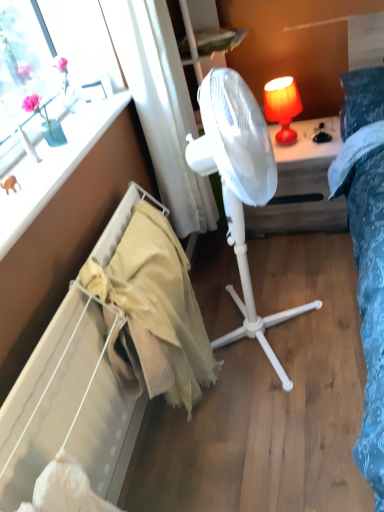
Question: Considering the relative sizes of white sheer curtain at upper center and white plastic fan at center in the image provided, is white sheer curtain at upper center taller than white plastic fan at center?

Choices:
 (A) no
 (B) yes

Answer: (B)

Question: Considering the relative sizes of white sheer curtain at upper center and white plastic fan at center in the image provided, is white sheer curtain at upper center bigger than white plastic fan at center?

Choices:
 (A) no
 (B) yes

Answer: (A)

Question: Is white sheer curtain at upper center at the left side of white plastic fan at center?

Choices:
 (A) no
 (B) yes

Answer: (B)

Question: Is white sheer curtain at upper center positioned with its back to white plastic fan at center?

Choices:
 (A) no
 (B) yes

Answer: (A)

Question: From a real-world perspective, does white sheer curtain at upper center sit lower than white plastic fan at center?

Choices:
 (A) yes
 (B) no

Answer: (B)

Question: Looking at their shapes, would you say white plastic fan at center is wider or thinner than white plastic fan at center?

Choices:
 (A) wide
 (B) thin

Answer: (B)

Question: Considering the positions of white plastic fan at center and white plastic fan at center in the image, is white plastic fan at center taller or shorter than white plastic fan at center?

Choices:
 (A) tall
 (B) short

Answer: (A)

Question: Is white plastic fan at center in front of or behind white plastic fan at center in the image?

Choices:
 (A) behind
 (B) front

Answer: (B)

Question: From the image's perspective, is white plastic fan at center positioned above or below white plastic fan at center?

Choices:
 (A) above
 (B) below

Answer: (B)

Question: From a real-world perspective, is white sheer curtain at upper center above or below beige fabric radiator at lower left?

Choices:
 (A) below
 (B) above

Answer: (B)

Question: From the image's perspective, is white sheer curtain at upper center located above or below beige fabric radiator at lower left?

Choices:
 (A) below
 (B) above

Answer: (B)

Question: In the image, is white sheer curtain at upper center positioned in front of or behind beige fabric radiator at lower left?

Choices:
 (A) front
 (B) behind

Answer: (B)

Question: Based on their sizes in the image, would you say white sheer curtain at upper center is bigger or smaller than beige fabric radiator at lower left?

Choices:
 (A) small
 (B) big

Answer: (B)

Question: Is white plastic fan at center in front of or behind white plastic fan at center in the image?

Choices:
 (A) behind
 (B) front

Answer: (A)

Question: Is white plastic fan at center bigger or smaller than white plastic fan at center?

Choices:
 (A) small
 (B) big

Answer: (A)